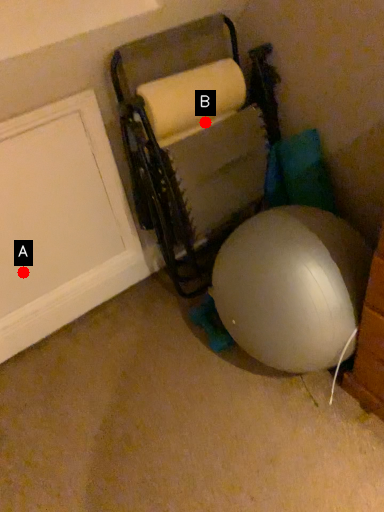
Question: Two points are circled on the image, labeled by A and B beside each circle. Among these points, which one is farthest from the camera?

Choices:
 (A) A is further
 (B) B is further

Answer: (A)